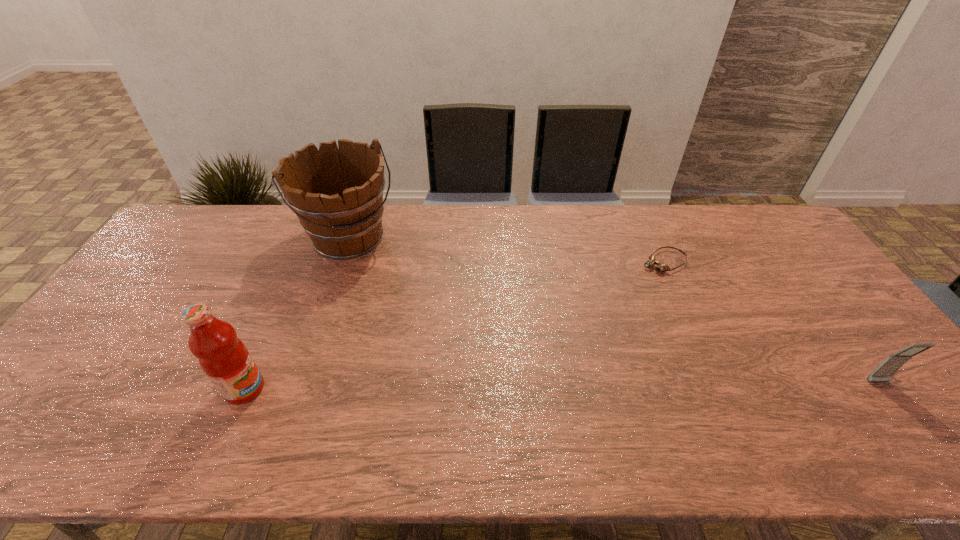
The height and width of the screenshot is (540, 960). I want to click on free spot located 0.250m with the handle on the wine bucket, so (x=410, y=313).

The image size is (960, 540). In order to click on free point located 0.110m with the handle on the wine bucket in this screenshot , I will do click(x=387, y=285).

The image size is (960, 540). I want to click on vacant space situated 0.110m with the handle on the wine bucket, so click(x=387, y=285).

Where is `object present at the far edge`? The height and width of the screenshot is (540, 960). object present at the far edge is located at coordinates (337, 194).

Find the location of a particular element. The image size is (960, 540). fruit juice that is at the near edge is located at coordinates (224, 358).

Where is `cellular telephone present at the near edge`? cellular telephone present at the near edge is located at coordinates (883, 373).

At what (x,y) coordinates should I click in order to perform the action: click on object located in the right edge section of the desktop. Please return your answer as a coordinate pair (x, y). Looking at the image, I should click on (x=883, y=373).

Locate an element on the screen. The image size is (960, 540). object that is at the near right corner is located at coordinates (883, 373).

You are a GUI agent. You are given a task and a screenshot of the screen. Output one action in this format:
    pyautogui.click(x=<x>, y=<y>)
    Task: Click on the vacant area at the far edge
    This screenshot has height=540, width=960.
    Given the screenshot: What is the action you would take?
    pyautogui.click(x=596, y=234)

This screenshot has width=960, height=540. Find the location of `vacant area at the near edge`. vacant area at the near edge is located at coordinates (160, 410).